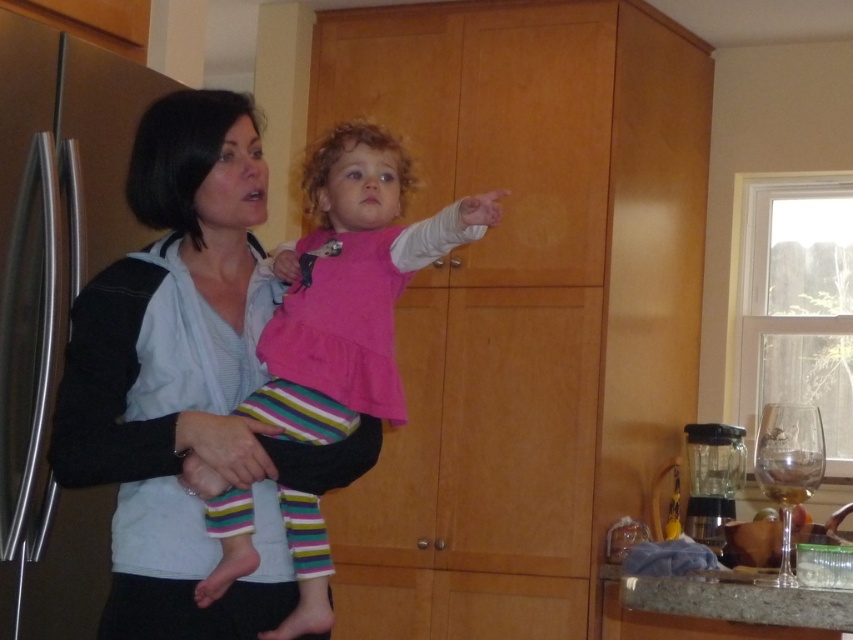
Question: In this image, where is pink fabric baby at center located relative to granite countertop at lower right?

Choices:
 (A) above
 (B) below

Answer: (A)

Question: Which point is farther from the camera taking this photo?

Choices:
 (A) (680, 612)
 (B) (300, 330)
 (C) (165, 156)

Answer: (A)

Question: Is matte black sweater at center above pink fabric baby at center?

Choices:
 (A) yes
 (B) no

Answer: (A)

Question: Can you confirm if pink fabric baby at center is positioned to the left of granite countertop at lower right?

Choices:
 (A) no
 (B) yes

Answer: (B)

Question: Among these objects, which one is nearest to the camera?

Choices:
 (A) granite countertop at lower right
 (B) pink fabric baby at center

Answer: (B)

Question: Which object is positioned farthest from the pink fabric baby at center?

Choices:
 (A) matte black sweater at center
 (B) granite countertop at lower right

Answer: (B)